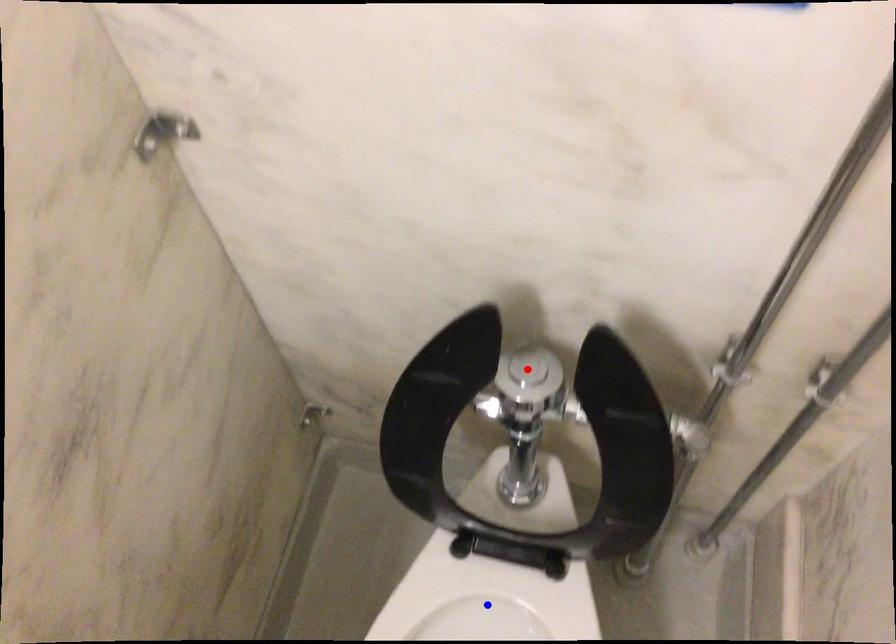
Question: Which of the two points in the image is closer to the camera?

Choices:
 (A) Blue point is closer.
 (B) Red point is closer.

Answer: (B)